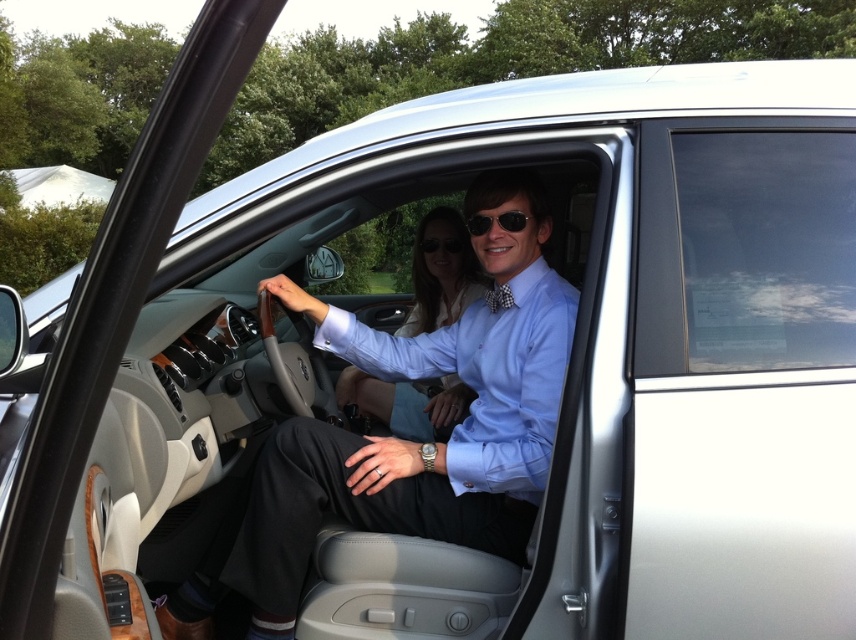
Looking at this image, can you confirm if sunglasses at center is positioned to the left of black plastic sunglasses at center?

No, sunglasses at center is not to the left of black plastic sunglasses at center.

Does sunglasses at center have a smaller size compared to black plastic sunglasses at center?

No.

Based on the photo, who is more forward, (510,216) or (421,250)?

Positioned in front is point (510,216).

The width and height of the screenshot is (856, 640). I want to click on sunglasses at center, so 498,221.

Which is behind, point (575, 289) or point (488, 214)?

Positioned behind is point (575, 289).

Image resolution: width=856 pixels, height=640 pixels. I want to click on light blue cotton dress shirt at center, so click(x=484, y=376).

Measure the distance between light blue cotton dress shirt at center and camera.

They are 5.83 feet apart.

At what (x,y) coordinates should I click in order to perform the action: click on light blue cotton dress shirt at center. Please return your answer as a coordinate pair (x, y). Image resolution: width=856 pixels, height=640 pixels. Looking at the image, I should click on (484, 376).

Is point (331, 307) positioned after point (431, 296)?

That is False.

Can you confirm if light blue cotton dress shirt at center is bigger than matte blue shirt at center?

Correct, light blue cotton dress shirt at center is larger in size than matte blue shirt at center.

Is point (496, 323) positioned in front of point (370, 392)?

Yes, it is.

Find the location of a particular element. light blue cotton dress shirt at center is located at coordinates (484, 376).